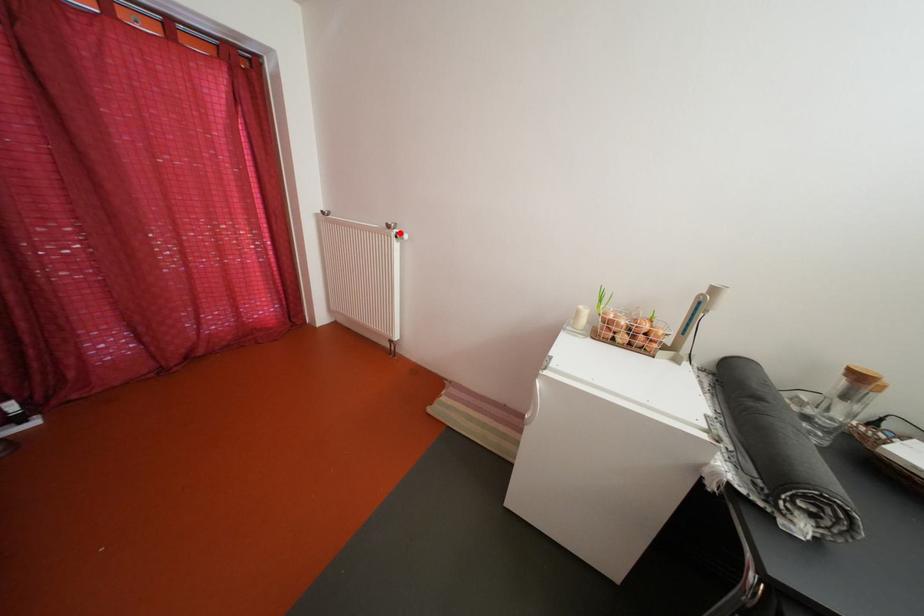
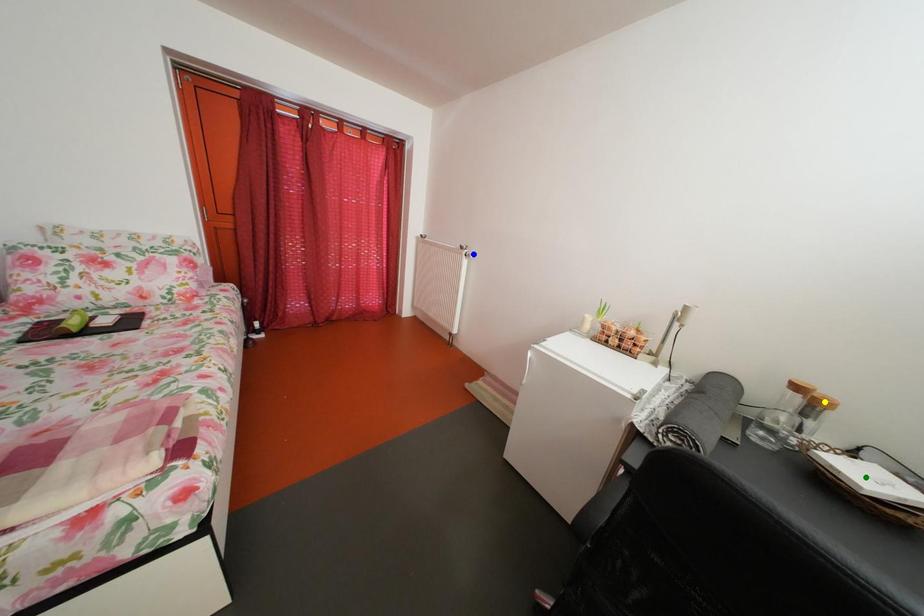
Question: I am providing you with two images of the same scene from different viewpoints. A red point is marked on the first image. You are given multiple points on the second image. In image 2, which mark is for the same physical point as the one in image 1?

Choices:
 (A) blue point
 (B) yellow point
 (C) green point

Answer: (A)